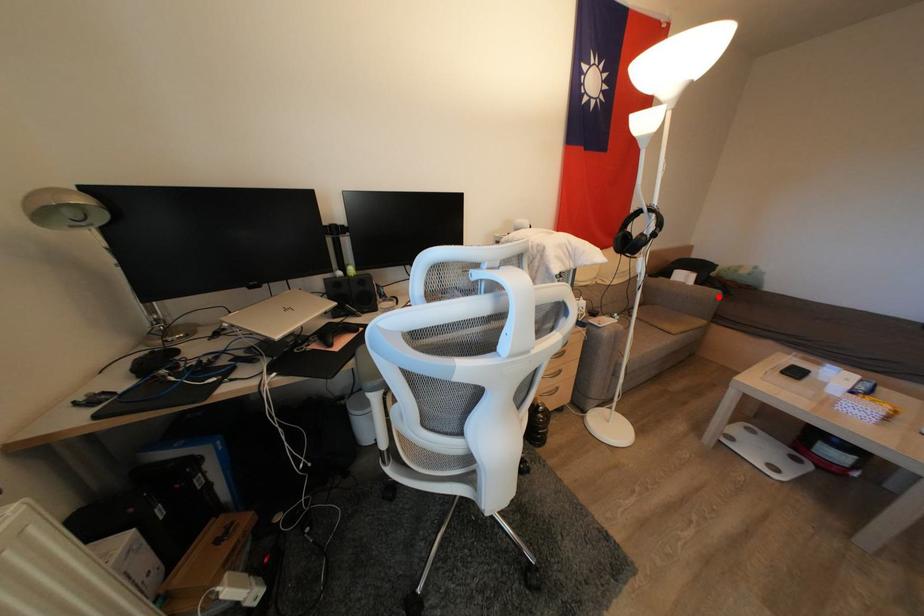
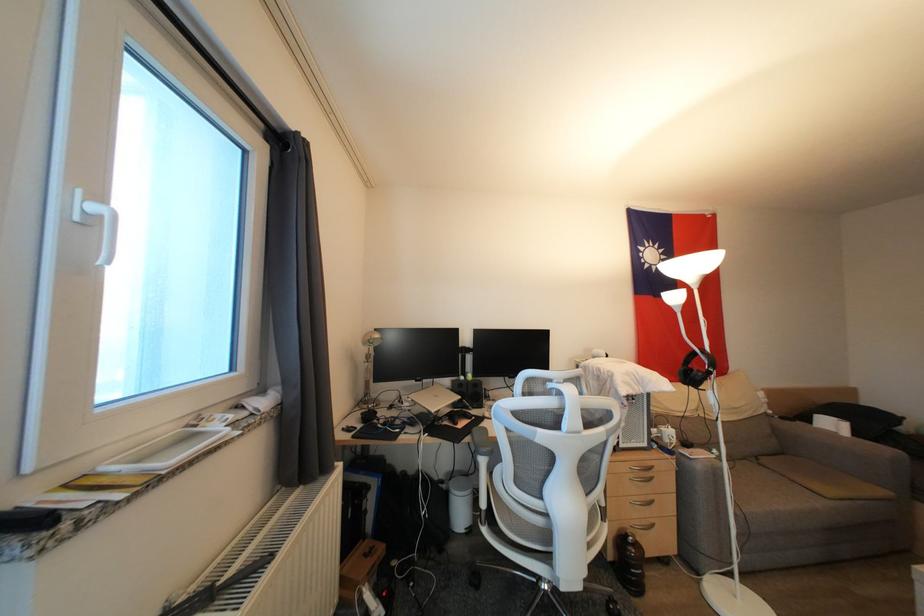
The point at the highlighted location is marked in the first image. Where is the corresponding point in the second image?

(893, 456)